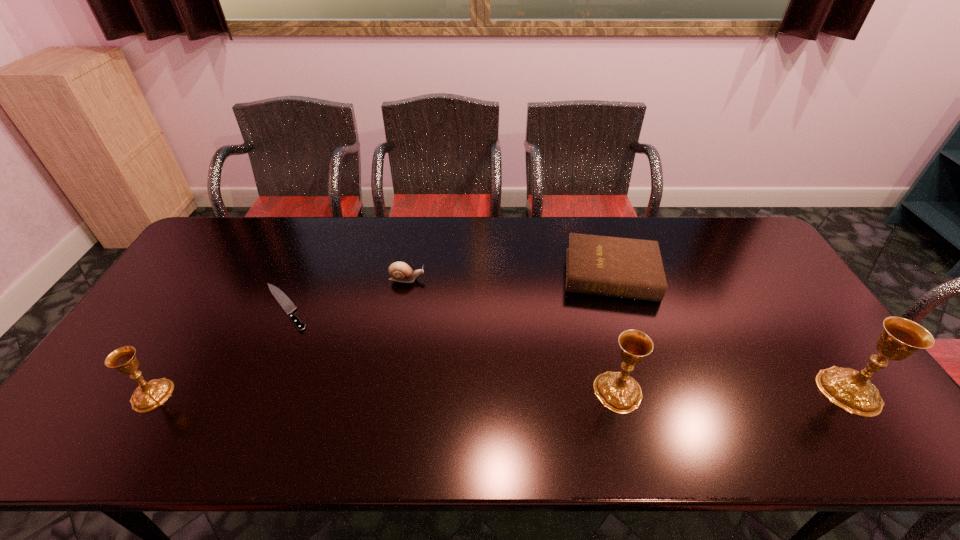
What are the coordinates of `the fourth shortest object` in the screenshot? It's located at (147, 396).

Find the location of `the leftmost chalice`. the leftmost chalice is located at coordinates (147, 396).

The width and height of the screenshot is (960, 540). I want to click on the second chalice from left to right, so click(619, 392).

The width and height of the screenshot is (960, 540). I want to click on the second shortest chalice, so click(x=619, y=392).

I want to click on the tallest chalice, so click(852, 390).

You are a GUI agent. You are given a task and a screenshot of the screen. Output one action in this format:
    pyautogui.click(x=<x>, y=<y>)
    Task: Click on the rightmost object
    
    Given the screenshot: What is the action you would take?
    pyautogui.click(x=852, y=390)

You are a GUI agent. You are given a task and a screenshot of the screen. Output one action in this format:
    pyautogui.click(x=<x>, y=<y>)
    Task: Click on the escargot
    
    Given the screenshot: What is the action you would take?
    pyautogui.click(x=399, y=271)

The height and width of the screenshot is (540, 960). I want to click on the shortest object, so click(287, 305).

Image resolution: width=960 pixels, height=540 pixels. Find the location of `steak knife`. steak knife is located at coordinates (287, 305).

Image resolution: width=960 pixels, height=540 pixels. I want to click on Bible, so click(629, 268).